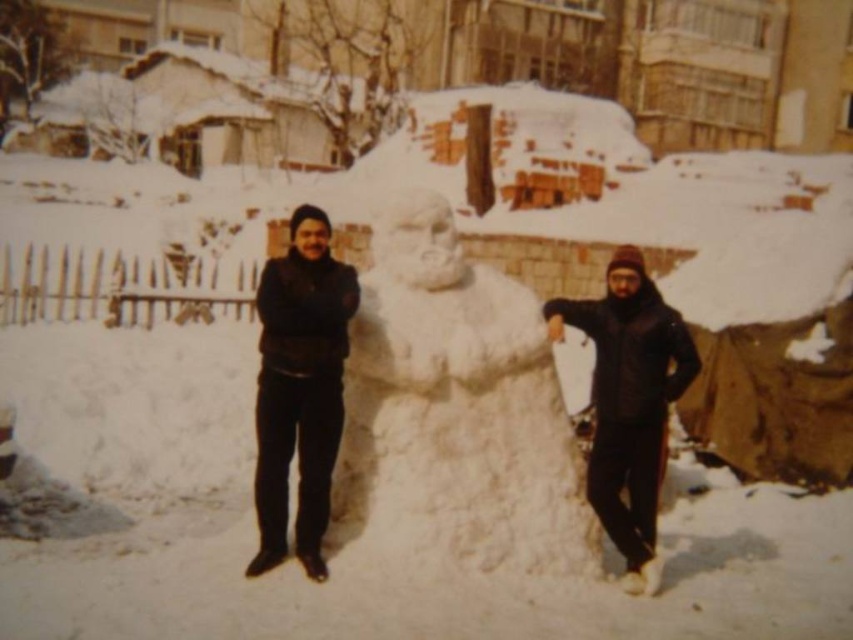
Question: In this image, where is white fluffy snowman at center located relative to black matte jacket at center?

Choices:
 (A) below
 (B) above

Answer: (A)

Question: Among these objects, which one is nearest to the camera?

Choices:
 (A) white fluffy snowman at center
 (B) black matte jacket at right
 (C) black matte jacket at center

Answer: (C)

Question: Considering the real-world distances, which object is closest to the black matte jacket at center?

Choices:
 (A) white fluffy snowman at center
 (B) black matte jacket at right

Answer: (A)

Question: Is white fluffy snowman at center bigger than black matte jacket at center?

Choices:
 (A) no
 (B) yes

Answer: (B)

Question: Does black matte jacket at center appear on the right side of black matte jacket at right?

Choices:
 (A) no
 (B) yes

Answer: (A)

Question: Estimate the real-world distances between objects in this image. Which object is farther from the black matte jacket at center?

Choices:
 (A) black matte jacket at right
 (B) white fluffy snowman at center

Answer: (A)